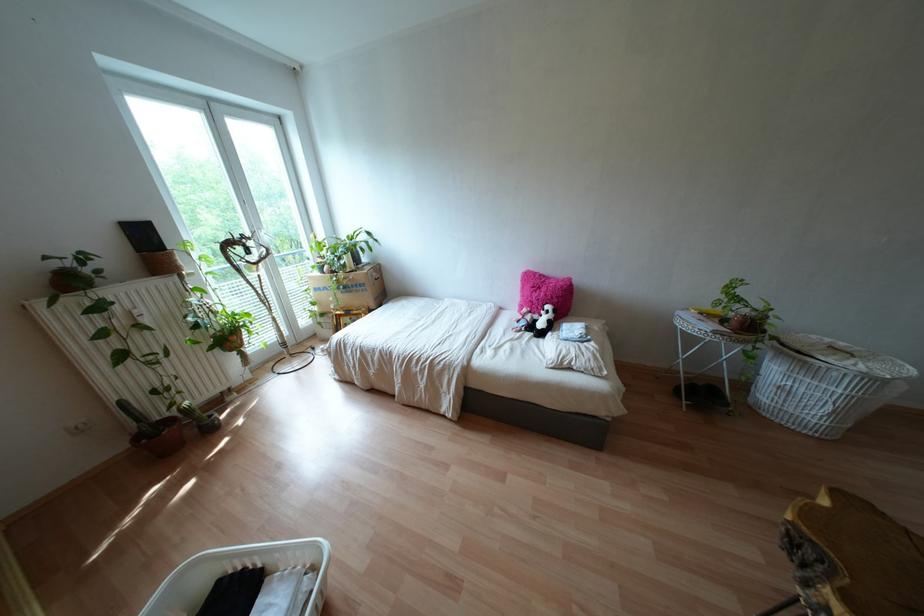
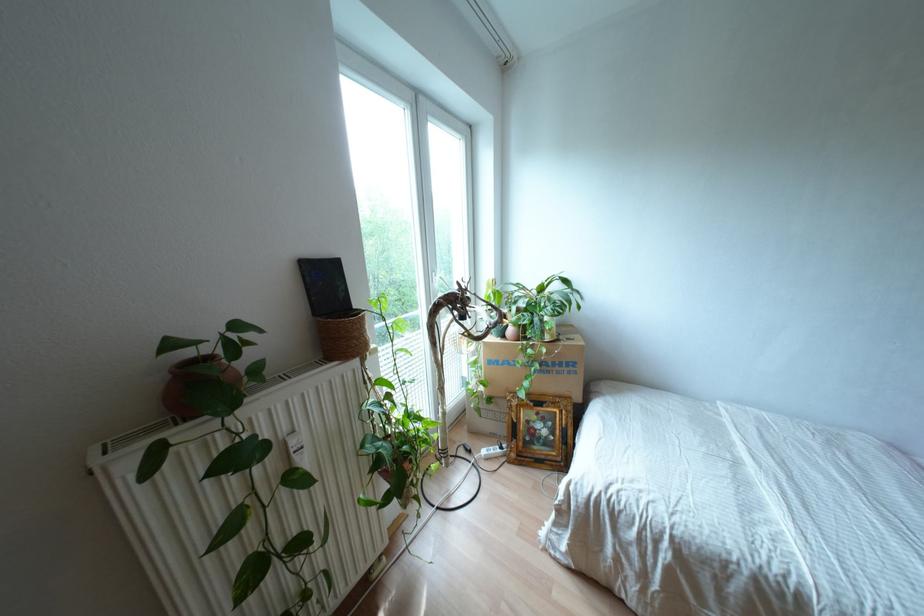
Locate, in the second image, the point that corresponds to (x=355, y=285) in the first image.

(560, 363)